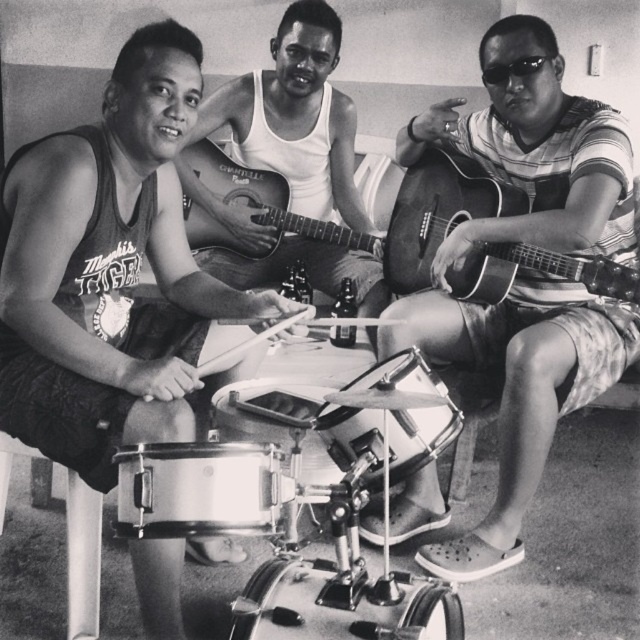
Consider the image. Is matte white tank top at center bigger than shiny metallic drum at lower center?

Yes.

Which is in front, point (304, 172) or point (339, 630)?

Point (339, 630) is more forward.

The width and height of the screenshot is (640, 640). In order to click on matte white tank top at center in this screenshot , I will do `click(296, 116)`.

Is shiny metallic drum at lower center above shiny silver drum at center?

No, shiny metallic drum at lower center is not above shiny silver drum at center.

Based on the photo, who is positioned more to the left, shiny metallic drum at lower center or shiny silver drum at center?

shiny metallic drum at lower center is more to the left.

This screenshot has height=640, width=640. Find the location of `shiny metallic drum at lower center`. shiny metallic drum at lower center is located at coordinates (340, 605).

In order to click on shiny metallic drum at lower center in this screenshot , I will do `click(340, 605)`.

In the scene shown: Does matte white tank top at center have a greater height compared to metallic silver drum at center?

Yes, matte white tank top at center is taller than metallic silver drum at center.

Which is in front, point (326, 29) or point (266, 524)?

Point (266, 524) is in front.

Find the location of a particular element. Image resolution: width=640 pixels, height=640 pixels. matte white tank top at center is located at coordinates (296, 116).